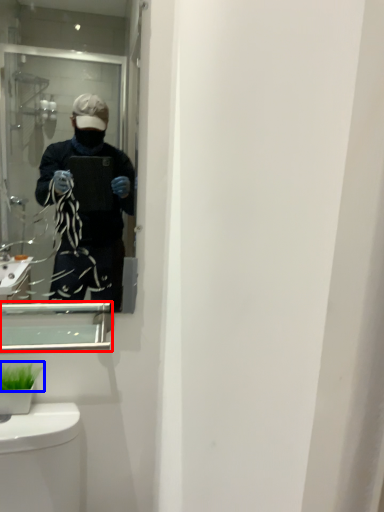
Question: Which object appears farthest to the camera in this image, medicine cabinet (highlighted by a red box) or plant (highlighted by a blue box)?

Choices:
 (A) medicine cabinet
 (B) plant

Answer: (B)